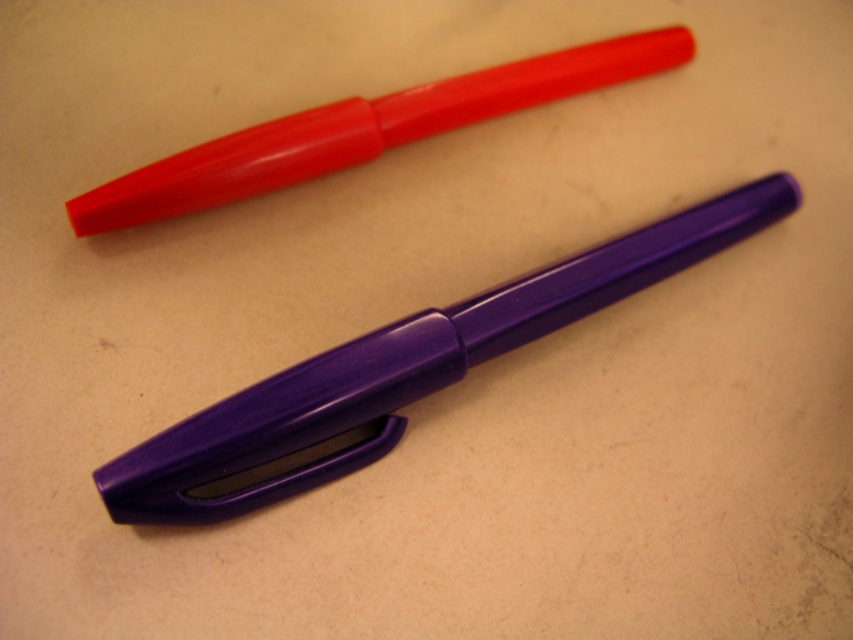
You are organizing a desk and need to place the glossy purple fountain pen at center. Where exactly should you position it relative to the other objects on the desk?

The glossy purple fountain pen at center is located at point (399, 372), so you should position it at that coordinate to ensure proper placement.

You have two pens on your desk. One is a glossy purple fountain pen at center and the other is a matte plastic pen at upper center. Which pen has a larger diameter?

The glossy purple fountain pen at center might be wider than the matte plastic pen at upper center.